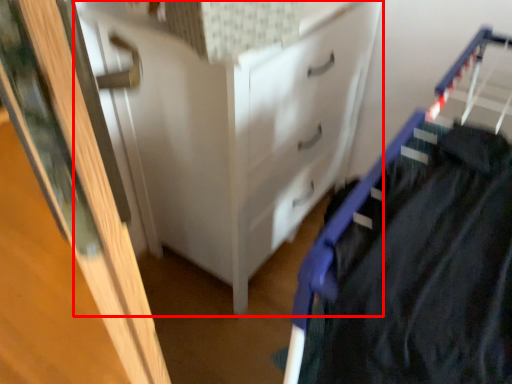
Question: From the image's perspective, what is the correct spatial relationship of chest of drawers (annotated by the red box) in relation to door?

Choices:
 (A) above
 (B) below

Answer: (A)